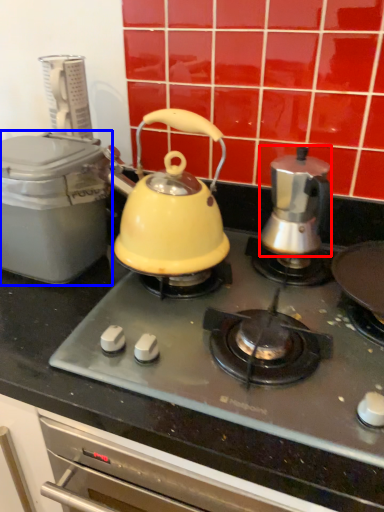
Question: Among these objects, which one is nearest to the camera, kettle (highlighted by a red box) or kitchen appliance (highlighted by a blue box)?

Choices:
 (A) kettle
 (B) kitchen appliance

Answer: (B)